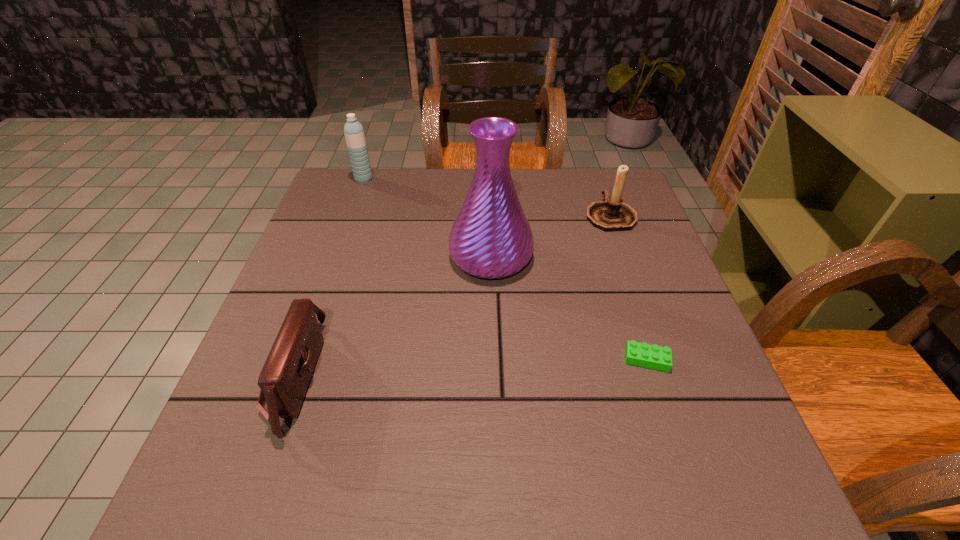
Locate an element on the screen. This screenshot has width=960, height=540. vase is located at coordinates (491, 238).

Where is `the tallest object`? This screenshot has height=540, width=960. the tallest object is located at coordinates (491, 238).

Identify the location of the farthest object. (354, 134).

This screenshot has width=960, height=540. Identify the location of water bottle. (354, 134).

The width and height of the screenshot is (960, 540). I want to click on the third shortest object, so click(x=612, y=214).

The height and width of the screenshot is (540, 960). What are the coordinates of `shoulder bag` in the screenshot? It's located at (284, 379).

Where is `Lego`? Lego is located at coordinates (653, 356).

In order to click on vacant space located on the front of the vase in this screenshot , I will do `click(494, 399)`.

Where is `free spot located 0.340m on the right of the farthest object`? The width and height of the screenshot is (960, 540). free spot located 0.340m on the right of the farthest object is located at coordinates (485, 180).

Where is `free spot located on the front of the third tallest object`? The height and width of the screenshot is (540, 960). free spot located on the front of the third tallest object is located at coordinates (651, 330).